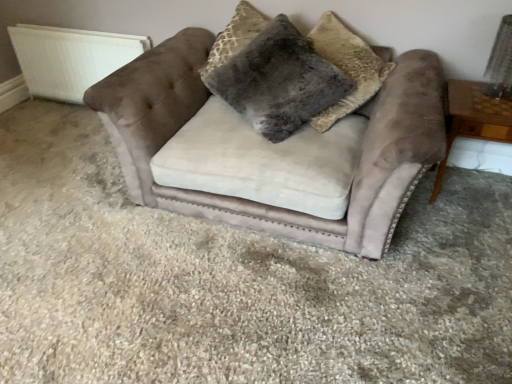
Question: Is fuzzy gray pillow at center, which is the first pillow from left to right, wider or thinner than wooden side table at right?

Choices:
 (A) wide
 (B) thin

Answer: (B)

Question: From the image's perspective, is fuzzy gray pillow at center, which is the first pillow from left to right, positioned above or below wooden side table at right?

Choices:
 (A) above
 (B) below

Answer: (A)

Question: Estimate the real-world distances between objects in this image. Which object is closer to the white textured radiator at upper left?

Choices:
 (A) velvet couch at center
 (B) fuzzy gray pillow at center, the first pillow when ordered from right to left
 (C) wooden side table at right
 (D) fuzzy gray pillow at center, which is counted as the 2th pillow, starting from the right

Answer: (A)

Question: Estimate the real-world distances between objects in this image. Which object is closer to the fuzzy gray pillow at center, which is counted as the 2th pillow, starting from the right?

Choices:
 (A) fuzzy gray pillow at center, which appears as the 2th pillow when viewed from the left
 (B) wooden side table at right
 (C) velvet couch at center
 (D) white textured radiator at upper left

Answer: (A)